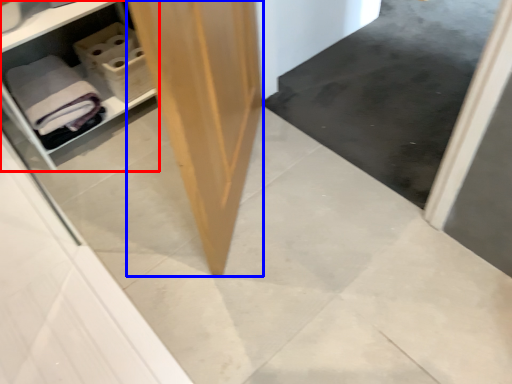
Question: Among these objects, which one is farthest to the camera, shelf (highlighted by a red box) or plywood (highlighted by a blue box)?

Choices:
 (A) shelf
 (B) plywood

Answer: (A)